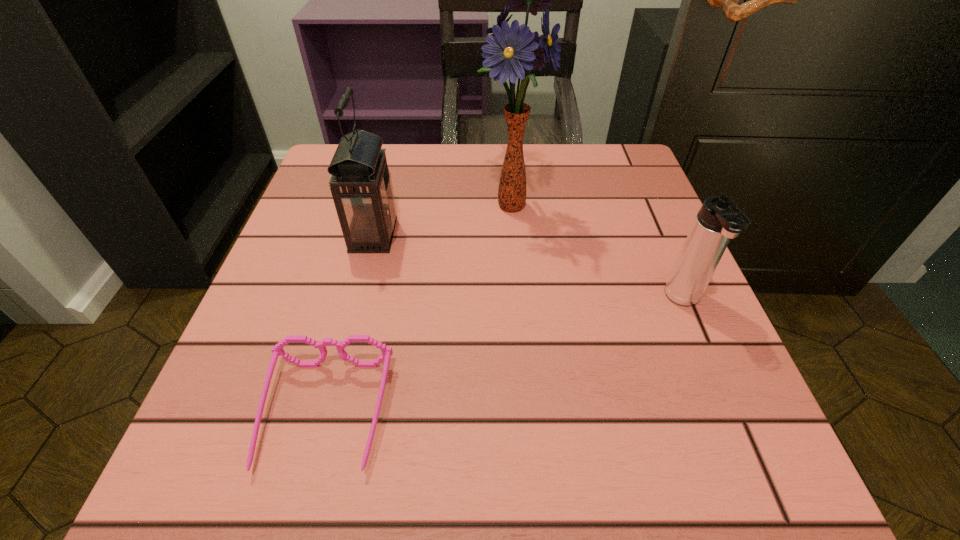
Where is `free space between the lantern and the nearest object`? The height and width of the screenshot is (540, 960). free space between the lantern and the nearest object is located at coordinates (349, 325).

This screenshot has height=540, width=960. Find the location of `vacant point located between the second object from right to left and the third shortest object`. vacant point located between the second object from right to left and the third shortest object is located at coordinates (442, 219).

This screenshot has width=960, height=540. Identify the location of object that stands as the second closest to the second tallest object. (278, 350).

Identify the location of object that stands as the closest to the spectacles. The image size is (960, 540). pyautogui.click(x=361, y=186).

The width and height of the screenshot is (960, 540). I want to click on free spot that satisfies the following two spatial constraints: 1. on the front-facing side of the second tallest object; 2. on the arms of the spectacles, so click(327, 415).

The image size is (960, 540). I want to click on free spot that satisfies the following two spatial constraints: 1. on the front-facing side of the lantern; 2. on the arms of the spectacles, so click(x=327, y=415).